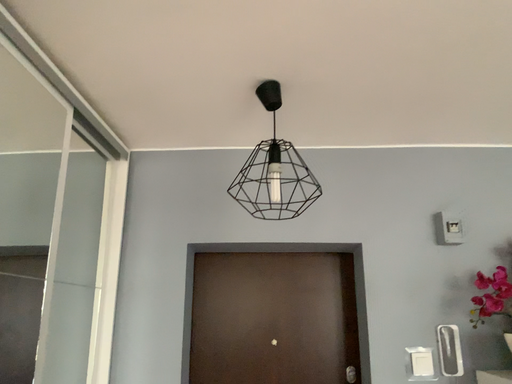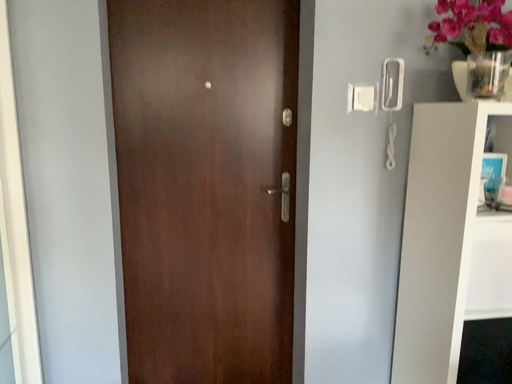
Question: How did the camera likely rotate when shooting the video?

Choices:
 (A) rotated left
 (B) rotated right

Answer: (B)